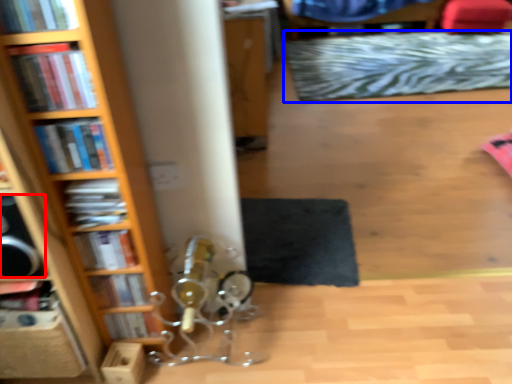
Question: Among these objects, which one is nearest to the camera, speaker (highlighted by a red box) or mat (highlighted by a blue box)?

Choices:
 (A) speaker
 (B) mat

Answer: (A)